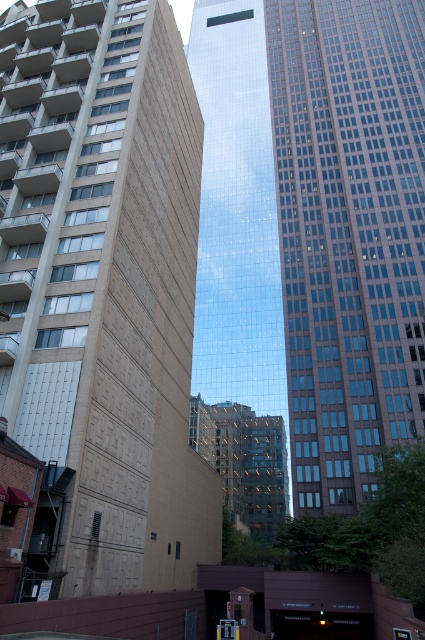
Can you confirm if brown textured building at center is positioned to the left of glassy reflective skyscraper at center?

Correct, you'll find brown textured building at center to the left of glassy reflective skyscraper at center.

Identify the location of brown textured building at center. (104, 289).

Is point (19, 228) more distant than point (207, 161)?

No, (19, 228) is closer to viewer.

What are the coordinates of `brown textured building at center` in the screenshot? It's located at (104, 289).